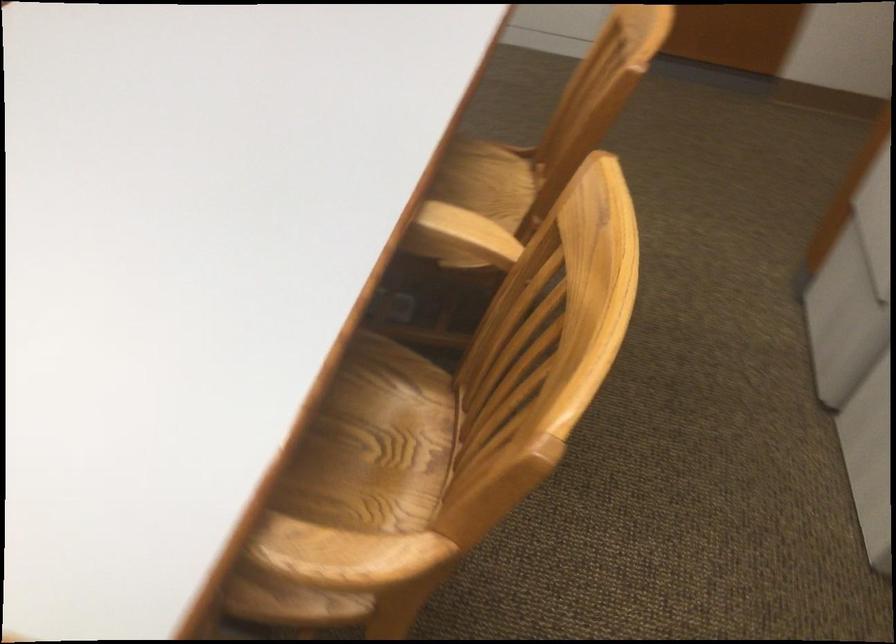
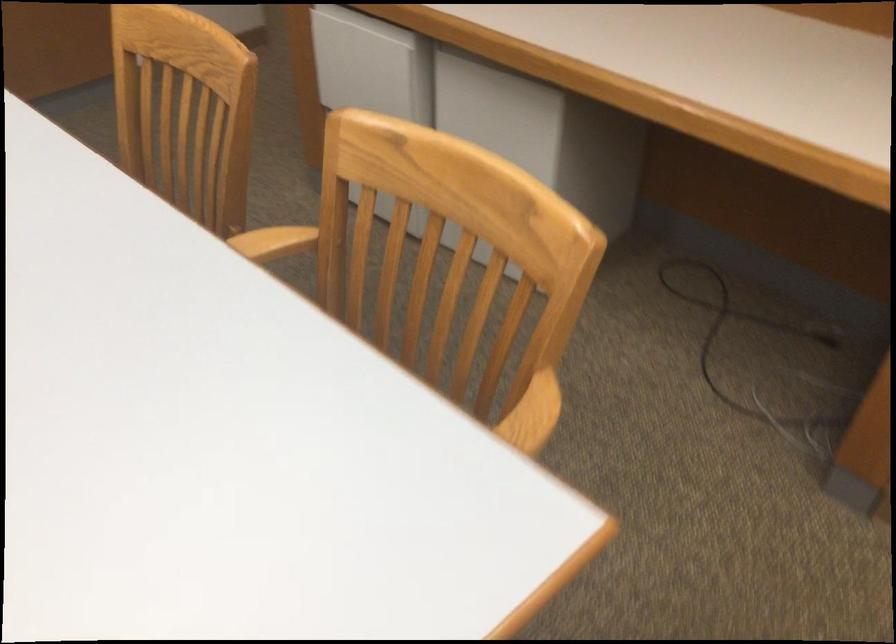
In the second image, find the point that corresponds to [494,252] in the first image.

(293, 241)